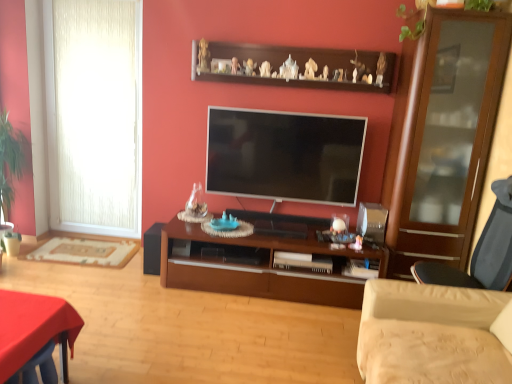
Question: Should I look upward or downward to see flat screen tv at center?

Choices:
 (A) up
 (B) down

Answer: (A)

Question: Does smooth red table at lower left appear on the right side of white textured curtain at left?

Choices:
 (A) no
 (B) yes

Answer: (B)

Question: Considering the relative sizes of smooth red table at lower left and white textured curtain at left in the image provided, is smooth red table at lower left wider than white textured curtain at left?

Choices:
 (A) no
 (B) yes

Answer: (B)

Question: Are smooth red table at lower left and white textured curtain at left beside each other?

Choices:
 (A) yes
 (B) no

Answer: (B)

Question: Is smooth red table at lower left looking in the opposite direction of white textured curtain at left?

Choices:
 (A) yes
 (B) no

Answer: (B)

Question: Is smooth red table at lower left further to the viewer compared to white textured curtain at left?

Choices:
 (A) no
 (B) yes

Answer: (A)

Question: Is smooth red table at lower left outside of white textured curtain at left?

Choices:
 (A) no
 (B) yes

Answer: (B)

Question: Is flat screen tv at center a part of beige fabric studio couch at lower right?

Choices:
 (A) yes
 (B) no

Answer: (B)

Question: Does beige fabric studio couch at lower right have a greater height compared to flat screen tv at center?

Choices:
 (A) no
 (B) yes

Answer: (B)

Question: Is beige fabric studio couch at lower right smaller than flat screen tv at center?

Choices:
 (A) yes
 (B) no

Answer: (B)

Question: Is beige fabric studio couch at lower right positioned in front of flat screen tv at center?

Choices:
 (A) yes
 (B) no

Answer: (A)

Question: From a real-world perspective, is beige fabric studio couch at lower right positioned under flat screen tv at center based on gravity?

Choices:
 (A) no
 (B) yes

Answer: (B)

Question: Is beige fabric studio couch at lower right positioned behind flat screen tv at center?

Choices:
 (A) no
 (B) yes

Answer: (A)

Question: Does green leafy plant at upper right, the 1th plant positioned from the front, appear on the left side of beige fabric studio couch at lower right?

Choices:
 (A) no
 (B) yes

Answer: (A)